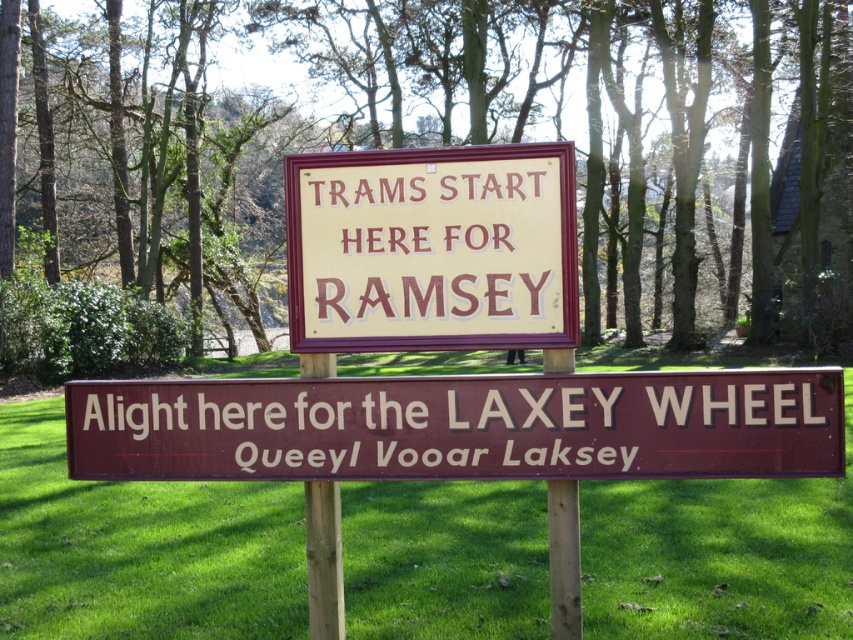
Is green leafy tree at center taller than green grass at lower center?

Yes.

Is green leafy tree at center bigger than green grass at lower center?

Yes, green leafy tree at center is bigger than green grass at lower center.

Locate an element on the screen. This screenshot has width=853, height=640. green leafy tree at center is located at coordinates (466, 147).

Between green leafy tree at center and yellow painted wood sign at center, which one has less height?

With less height is yellow painted wood sign at center.

Find the location of a particular element. green leafy tree at center is located at coordinates (466, 147).

Measure the distance between point (747, 120) and camera.

The distance of point (747, 120) from camera is 108.58 feet.

Locate an element on the screen. green leafy tree at center is located at coordinates (466, 147).

Does brown wooden sign at center lie in front of yellow painted wood sign at center?

Yes, it is.

Which is above, brown wooden sign at center or yellow painted wood sign at center?

Positioned higher is yellow painted wood sign at center.

Where is `brown wooden sign at center`? brown wooden sign at center is located at coordinates (462, 426).

At what (x,y) coordinates should I click in order to perform the action: click on brown wooden sign at center. Please return your answer as a coordinate pair (x, y). The width and height of the screenshot is (853, 640). Looking at the image, I should click on 462,426.